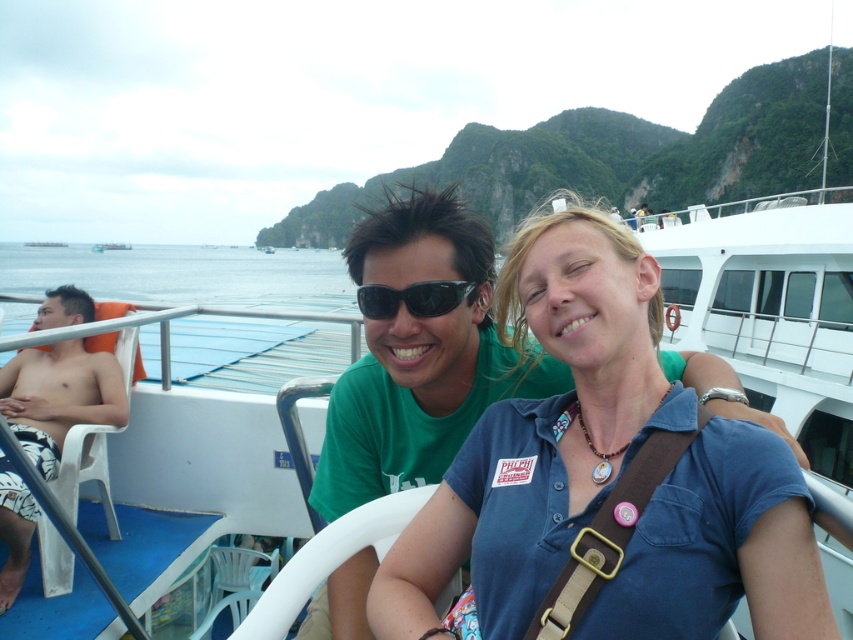
You are a photographer on the boat and want to capture a photo of the white textured shorts at left and the black plastic sunglasses at center. Based on their positions, which object should you focus on first if you start from the left side of the scene?

The white textured shorts at left should be focused on first since it is positioned to the left of the black plastic sunglasses at center.

You are a photographer trying to capture a closeup of the white textured shorts at left and the black plastic sunglasses at center. Since you want to focus on both objects equally, which one should you adjust your camera settings to prioritize in terms of size in the frame?

The white textured shorts at left is bigger than the black plastic sunglasses at center, so to focus on both equally, you should adjust your camera settings to make the white textured shorts at left smaller or the black plastic sunglasses at center larger in the frame.